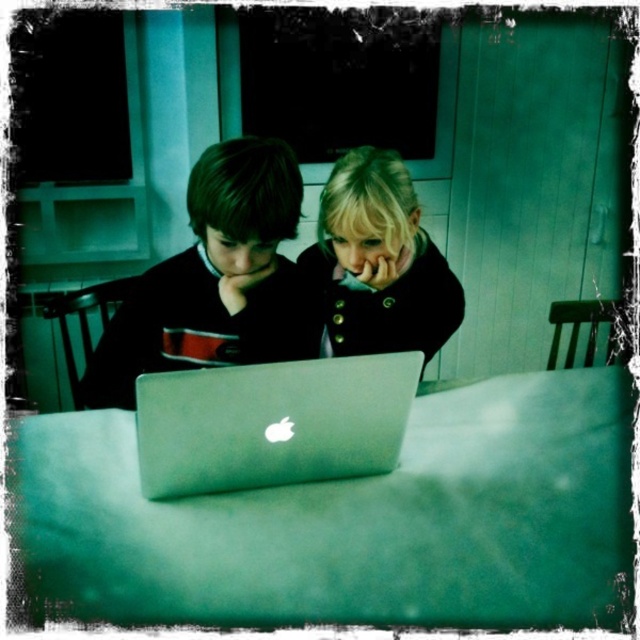
Who is more distant from viewer, (x=188, y=292) or (x=323, y=406)?

Positioned behind is point (x=188, y=292).

Can you confirm if matte black laptop at center is taller than silver metallic laptop at center?

Indeed, matte black laptop at center has a greater height compared to silver metallic laptop at center.

The height and width of the screenshot is (640, 640). What are the coordinates of `matte black laptop at center` in the screenshot? It's located at (212, 278).

Does metallic silver laptop at center appear on the left side of matte black laptop at center?

No, metallic silver laptop at center is not to the left of matte black laptop at center.

Between metallic silver laptop at center and matte black laptop at center, which one is positioned lower?

Positioned lower is metallic silver laptop at center.

Is point (419, 458) closer to camera compared to point (120, 388)?

Yes, it is.

At what (x,y) coordinates should I click in order to perform the action: click on metallic silver laptop at center. Please return your answer as a coordinate pair (x, y). Image resolution: width=640 pixels, height=640 pixels. Looking at the image, I should click on (349, 520).

Is point (294, 444) more distant than point (417, 307)?

No, (294, 444) is in front of (417, 307).

Is silver metallic laptop at center behind matte black coat at center?

No, it is not.

Which is in front, point (250, 412) or point (378, 342)?

Point (250, 412) is more forward.

The height and width of the screenshot is (640, 640). I want to click on silver metallic laptop at center, so click(272, 422).